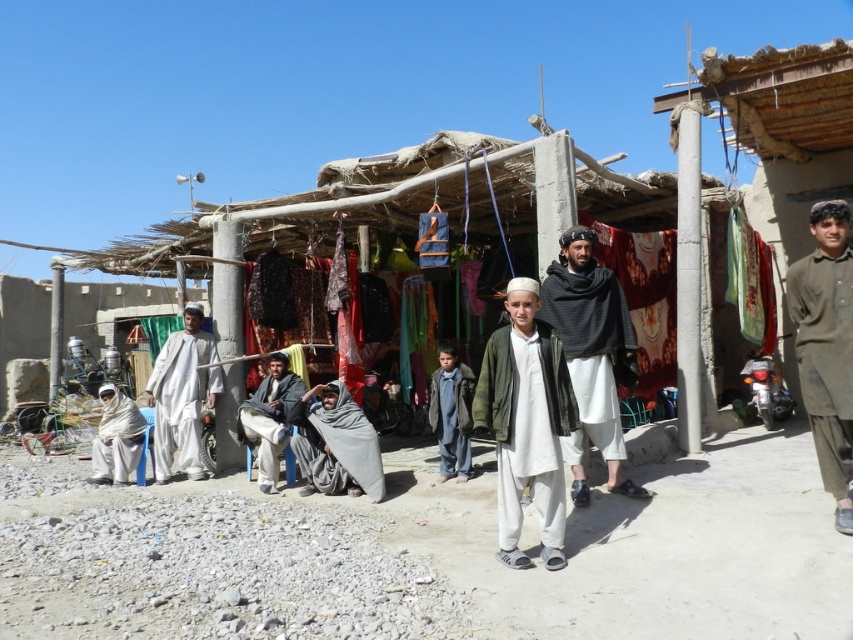
Question: Which is farther from the gray woolen robe at lower center?

Choices:
 (A) green matte jacket at center
 (B) dark gray woolen shawl at center

Answer: (A)

Question: Is dark gray woolen shawl at center closer to the viewer compared to dark gray fabric at center?

Choices:
 (A) yes
 (B) no

Answer: (A)

Question: Can you confirm if gray woolen robe at lower center is positioned below dark gray woolen robe at center?

Choices:
 (A) yes
 (B) no

Answer: (A)

Question: From the image, what is the correct spatial relationship of green matte jacket at center in relation to dark gray woolen robe at center?

Choices:
 (A) left
 (B) right

Answer: (B)

Question: Which is nearer to the brown cotton shirt at right?

Choices:
 (A) dark gray woolen robe at center
 (B) gray woolen robe at lower center
 (C) white cotton robe at lower left

Answer: (A)

Question: Which object is the farthest from the dark gray woolen robe at center?

Choices:
 (A) brown cotton shirt at right
 (B) light beige fabric at center
 (C) gray woolen robe at lower center
 (D) white cotton robe at lower left

Answer: (D)